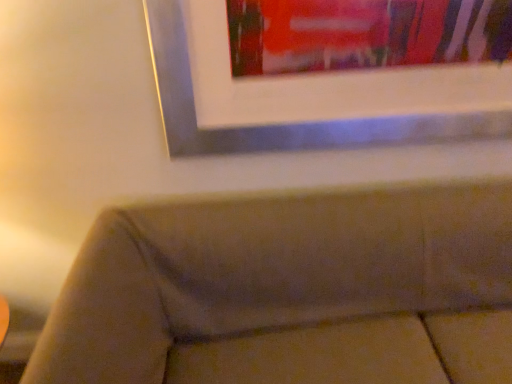
The height and width of the screenshot is (384, 512). What do you see at coordinates (290, 291) in the screenshot?
I see `velvet beige couch at lower center` at bounding box center [290, 291].

Identify the location of velvet beige couch at lower center. The width and height of the screenshot is (512, 384). (290, 291).

In order to face metallic silver picture frame at upper center, should I rotate leftwards or rightwards?

To face it directly, rotate right by 12.600 degrees.

What is the approximate height of metallic silver picture frame at upper center?

metallic silver picture frame at upper center is 17.56 inches in height.

The image size is (512, 384). What do you see at coordinates (282, 125) in the screenshot? I see `metallic silver picture frame at upper center` at bounding box center [282, 125].

Image resolution: width=512 pixels, height=384 pixels. I want to click on metallic silver picture frame at upper center, so click(x=282, y=125).

The width and height of the screenshot is (512, 384). What are the coordinates of `velvet beige couch at lower center` in the screenshot? It's located at pos(290,291).

In the scene shown: In the image, is metallic silver picture frame at upper center on the left side or the right side of velvet beige couch at lower center?

Based on their positions, metallic silver picture frame at upper center is located to the left of velvet beige couch at lower center.

Between metallic silver picture frame at upper center and velvet beige couch at lower center, which one is positioned in front?

velvet beige couch at lower center is closer to the camera.

Between point (384, 133) and point (283, 279), which one is positioned in front?

The point (384, 133) is closer to the camera.

From the image's perspective, is metallic silver picture frame at upper center above or below velvet beige couch at lower center?

Based on their image positions, metallic silver picture frame at upper center is located above velvet beige couch at lower center.

From a real-world perspective, which is physically above, metallic silver picture frame at upper center or velvet beige couch at lower center?

Answer: metallic silver picture frame at upper center.

Which object is thinner, metallic silver picture frame at upper center or velvet beige couch at lower center?

metallic silver picture frame at upper center is thinner.

From their relative heights in the image, would you say metallic silver picture frame at upper center is taller or shorter than velvet beige couch at lower center?

In the image, metallic silver picture frame at upper center appears to be shorter than velvet beige couch at lower center.

Between metallic silver picture frame at upper center and velvet beige couch at lower center, which one has larger size?

With larger size is velvet beige couch at lower center.

Looking at this image, would you say metallic silver picture frame at upper center is outside velvet beige couch at lower center?

Absolutely, metallic silver picture frame at upper center is external to velvet beige couch at lower center.

Is metallic silver picture frame at upper center placed right next to velvet beige couch at lower center?

No, metallic silver picture frame at upper center is not with velvet beige couch at lower center.

Is metallic silver picture frame at upper center looking in the opposite direction of velvet beige couch at lower center?

metallic silver picture frame at upper center does not have its back to velvet beige couch at lower center.

In the scene shown: How much distance is there between metallic silver picture frame at upper center and velvet beige couch at lower center?

metallic silver picture frame at upper center and velvet beige couch at lower center are 40.83 centimeters apart.

Identify the location of studio couch in front of the metallic silver picture frame at upper center. (290, 291).

Visually, is velvet beige couch at lower center positioned to the left or to the right of metallic silver picture frame at upper center?

velvet beige couch at lower center is to the right of metallic silver picture frame at upper center.

Is velvet beige couch at lower center positioned in front of metallic silver picture frame at upper center?

Yes, it is in front of metallic silver picture frame at upper center.

Considering the points (440, 315) and (426, 122), which point is in front, point (440, 315) or point (426, 122)?

Point (426, 122)

From the image's perspective, which one is positioned lower, velvet beige couch at lower center or metallic silver picture frame at upper center?

velvet beige couch at lower center.

From a real-world perspective, who is located higher, velvet beige couch at lower center or metallic silver picture frame at upper center?

metallic silver picture frame at upper center is physically above.

Can you confirm if velvet beige couch at lower center is wider than metallic silver picture frame at upper center?

Indeed, velvet beige couch at lower center has a greater width compared to metallic silver picture frame at upper center.

Is velvet beige couch at lower center taller or shorter than metallic silver picture frame at upper center?

In the image, velvet beige couch at lower center appears to be taller than metallic silver picture frame at upper center.

Is velvet beige couch at lower center bigger or smaller than metallic silver picture frame at upper center?

velvet beige couch at lower center is bigger than metallic silver picture frame at upper center.

Can metallic silver picture frame at upper center be found inside velvet beige couch at lower center?

No, metallic silver picture frame at upper center is not a part of velvet beige couch at lower center.

Is velvet beige couch at lower center not near metallic silver picture frame at upper center?

They are positioned close to each other.

Could you tell me if velvet beige couch at lower center is turned towards metallic silver picture frame at upper center?

No, velvet beige couch at lower center is not facing towards metallic silver picture frame at upper center.

What's the angular difference between velvet beige couch at lower center and metallic silver picture frame at upper center's facing directions?

0.0315 degrees.

How far apart are velvet beige couch at lower center and metallic silver picture frame at upper center?

velvet beige couch at lower center is 40.83 centimeters from metallic silver picture frame at upper center.

This screenshot has width=512, height=384. I want to click on studio couch on the right of metallic silver picture frame at upper center, so click(290, 291).

Where is `picture frame that appears above the velvet beige couch at lower center (from a real-world perspective)`? This screenshot has width=512, height=384. picture frame that appears above the velvet beige couch at lower center (from a real-world perspective) is located at coordinates (282, 125).

Find the location of a particular element. The width and height of the screenshot is (512, 384). picture frame lying behind the velvet beige couch at lower center is located at coordinates (282, 125).